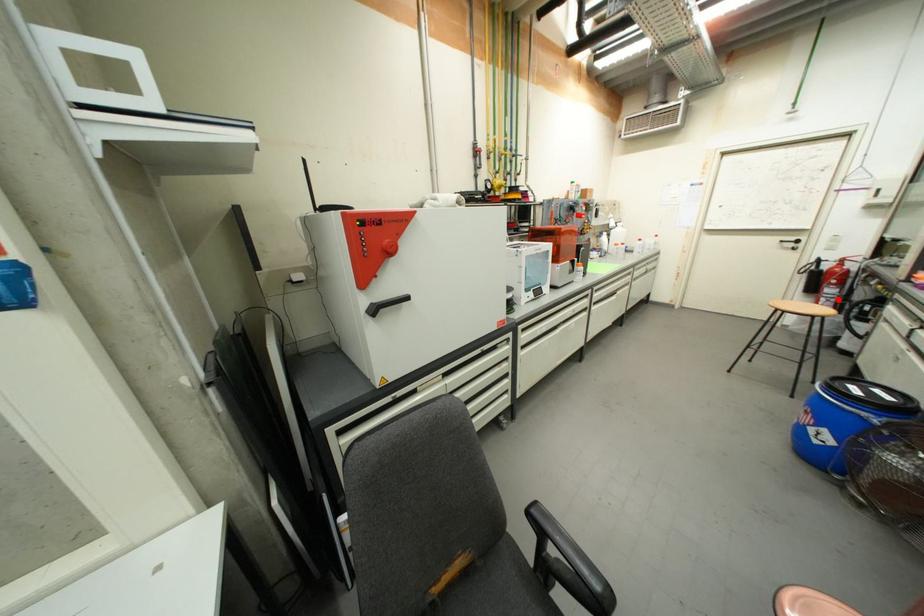
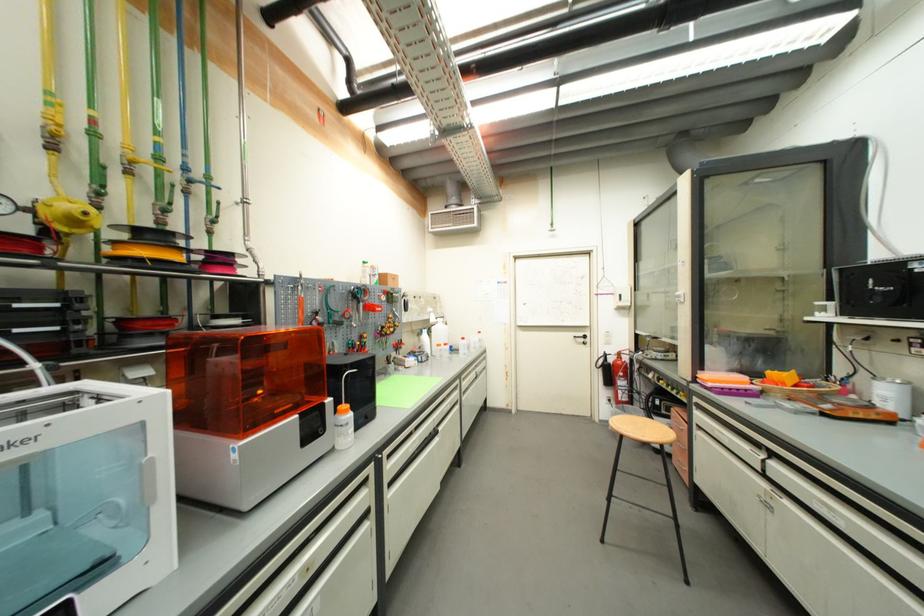
Where in the second image is the point corresponding to the highlighted location from the first image?

(630, 391)